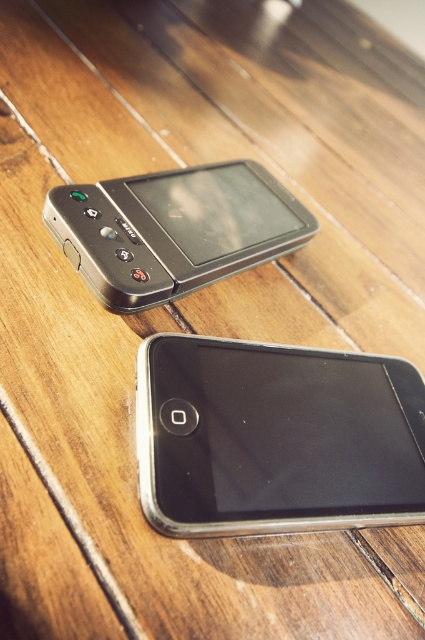
Question: Which object is farther from the camera taking this photo?

Choices:
 (A) matte black phone at upper center
 (B) black plastic smartphone at center

Answer: (A)

Question: Can you confirm if black plastic smartphone at center is thinner than matte black phone at upper center?

Choices:
 (A) no
 (B) yes

Answer: (B)

Question: Does black plastic smartphone at center have a lesser width compared to matte black phone at upper center?

Choices:
 (A) yes
 (B) no

Answer: (A)

Question: Is black plastic smartphone at center to the left of matte black phone at upper center from the viewer's perspective?

Choices:
 (A) yes
 (B) no

Answer: (B)

Question: Which point is closer to the camera taking this photo?

Choices:
 (A) (334, 470)
 (B) (141, 237)

Answer: (A)